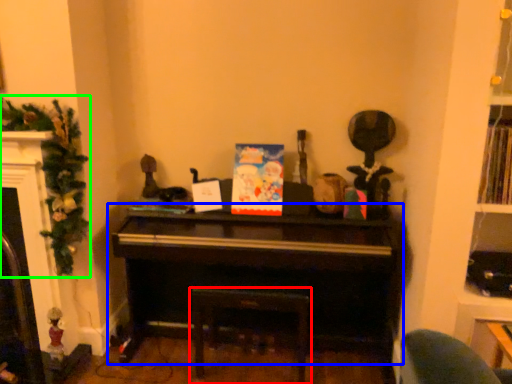
Question: Based on their relative distances, which object is nearer to furniture (highlighted by a red box)? Choose from piano (highlighted by a blue box) and christmas decoration (highlighted by a green box).

Choices:
 (A) piano
 (B) christmas decoration

Answer: (A)